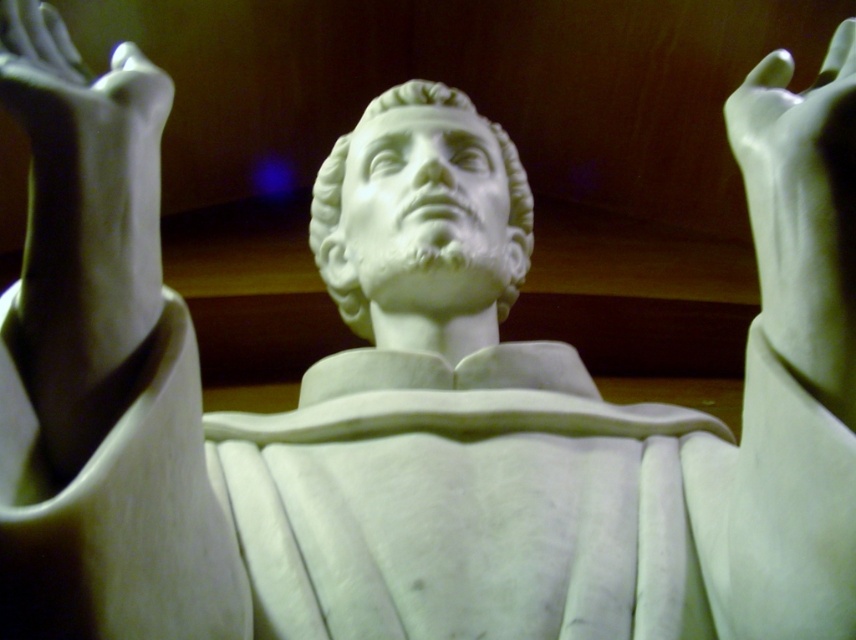
Who is taller, white marble hand at upper right or white marble bust at center?

white marble hand at upper right

What do you see at coordinates (803, 212) in the screenshot? The image size is (856, 640). I see `white marble hand at upper right` at bounding box center [803, 212].

Is point (742, 116) positioned before point (337, 301)?

That is True.

Where is `white marble hand at upper right`? The width and height of the screenshot is (856, 640). white marble hand at upper right is located at coordinates (803, 212).